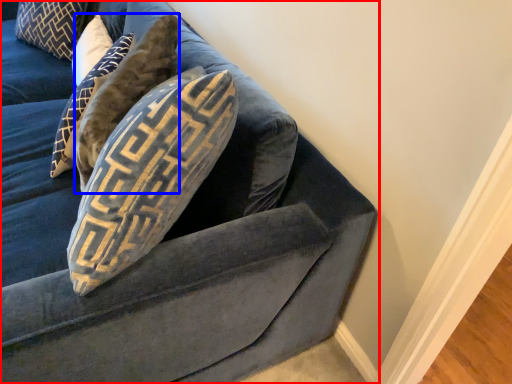
Question: Which object appears closest to the camera in this image, studio couch (highlighted by a red box) or pillow (highlighted by a blue box)?

Choices:
 (A) studio couch
 (B) pillow

Answer: (A)